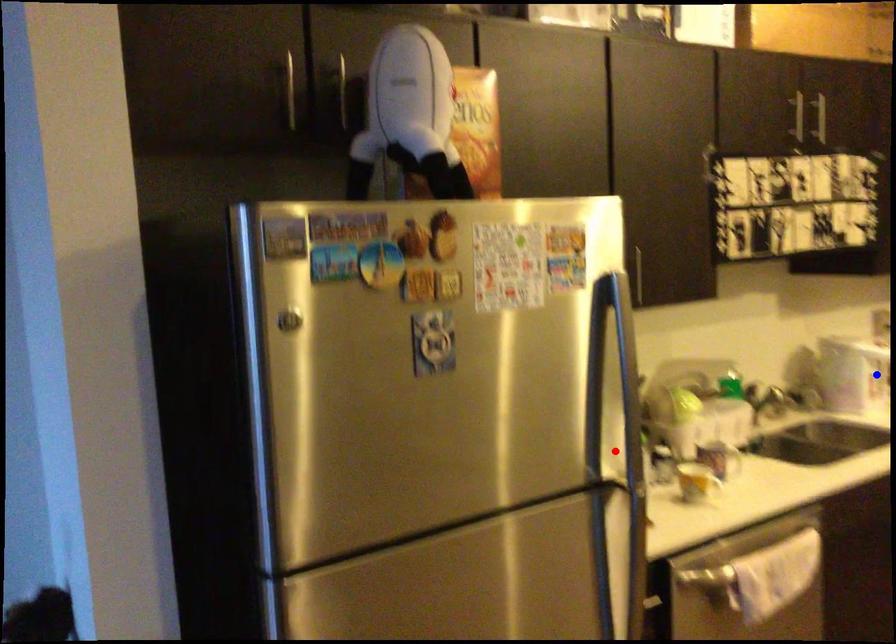
Question: Which of the two points in the image is closer to the camera?

Choices:
 (A) Blue point is closer.
 (B) Red point is closer.

Answer: (B)